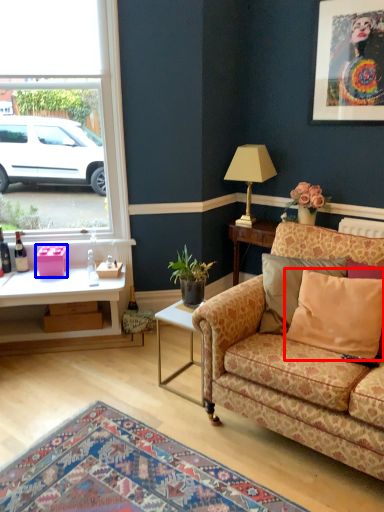
Question: Which of the following is the farthest to the observer, pillow (highlighted by a red box) or box (highlighted by a blue box)?

Choices:
 (A) pillow
 (B) box

Answer: (B)